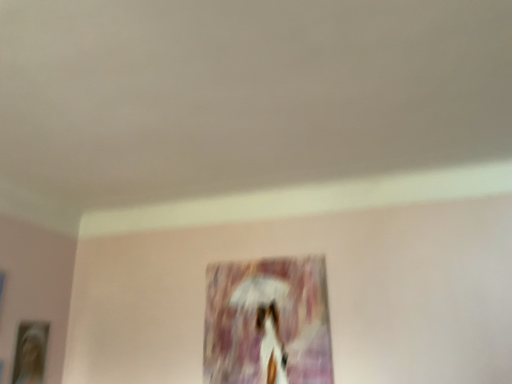
Question: Considering the relative positions of matte purple painting at center, the first picture frame when ordered from right to left, and wooden photo frame at lower left, the 2th picture frame when ordered from right to left, in the image provided, is matte purple painting at center, the first picture frame when ordered from right to left, in front of wooden photo frame at lower left, the 2th picture frame when ordered from right to left,?

Choices:
 (A) no
 (B) yes

Answer: (B)

Question: From the image's perspective, does matte purple painting at center, arranged as the 2th picture frame when viewed from the left, appear lower than wooden photo frame at lower left, the 2th picture frame when ordered from right to left?

Choices:
 (A) no
 (B) yes

Answer: (A)

Question: Does matte purple painting at center, the first picture frame when ordered from right to left, have a lesser height compared to wooden photo frame at lower left, the 2th picture frame when ordered from right to left?

Choices:
 (A) yes
 (B) no

Answer: (B)

Question: Considering the relative sizes of matte purple painting at center, the first picture frame when ordered from right to left, and wooden photo frame at lower left, the 2th picture frame when ordered from right to left, in the image provided, is matte purple painting at center, the first picture frame when ordered from right to left, thinner than wooden photo frame at lower left, the 2th picture frame when ordered from right to left,?

Choices:
 (A) yes
 (B) no

Answer: (A)

Question: Is wooden photo frame at lower left, the 2th picture frame when ordered from right to left, a part of matte purple painting at center, arranged as the 2th picture frame when viewed from the left?

Choices:
 (A) yes
 (B) no

Answer: (B)

Question: Is matte purple painting at center, arranged as the 2th picture frame when viewed from the left, facing towards wooden photo frame at lower left, the 2th picture frame when ordered from right to left?

Choices:
 (A) no
 (B) yes

Answer: (A)

Question: Can you confirm if wooden photo frame at lower left, the 2th picture frame when ordered from right to left, is shorter than matte purple painting at center, the first picture frame when ordered from right to left?

Choices:
 (A) no
 (B) yes

Answer: (B)

Question: Is wooden photo frame at lower left, the 2th picture frame when ordered from right to left, not inside matte purple painting at center, arranged as the 2th picture frame when viewed from the left?

Choices:
 (A) yes
 (B) no

Answer: (A)

Question: Considering the relative sizes of wooden photo frame at lower left, the 2th picture frame when ordered from right to left, and matte purple painting at center, arranged as the 2th picture frame when viewed from the left, in the image provided, is wooden photo frame at lower left, the 2th picture frame when ordered from right to left, wider than matte purple painting at center, arranged as the 2th picture frame when viewed from the left,?

Choices:
 (A) yes
 (B) no

Answer: (A)

Question: Is wooden photo frame at lower left, the 2th picture frame when ordered from right to left, far away from matte purple painting at center, arranged as the 2th picture frame when viewed from the left?

Choices:
 (A) yes
 (B) no

Answer: (A)

Question: Is wooden photo frame at lower left, the 1th picture frame viewed from the left, thinner than matte purple painting at center, the first picture frame when ordered from right to left?

Choices:
 (A) no
 (B) yes

Answer: (A)

Question: Is the position of wooden photo frame at lower left, the 2th picture frame when ordered from right to left, more distant than that of matte purple painting at center, arranged as the 2th picture frame when viewed from the left?

Choices:
 (A) yes
 (B) no

Answer: (A)

Question: Considering their positions, is matte purple painting at center, the first picture frame when ordered from right to left, located in front of or behind wooden photo frame at lower left, the 2th picture frame when ordered from right to left?

Choices:
 (A) behind
 (B) front

Answer: (B)